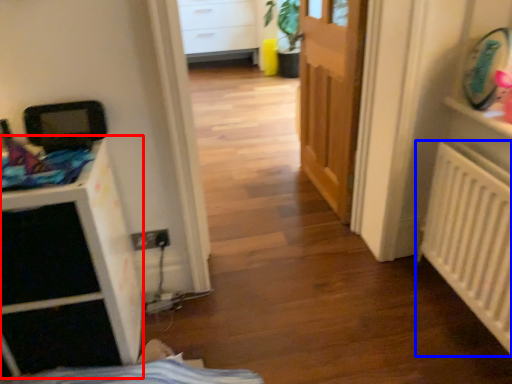
Question: Which object appears closest to the camera in this image, file cabinet (highlighted by a red box) or radiator (highlighted by a blue box)?

Choices:
 (A) file cabinet
 (B) radiator

Answer: (A)